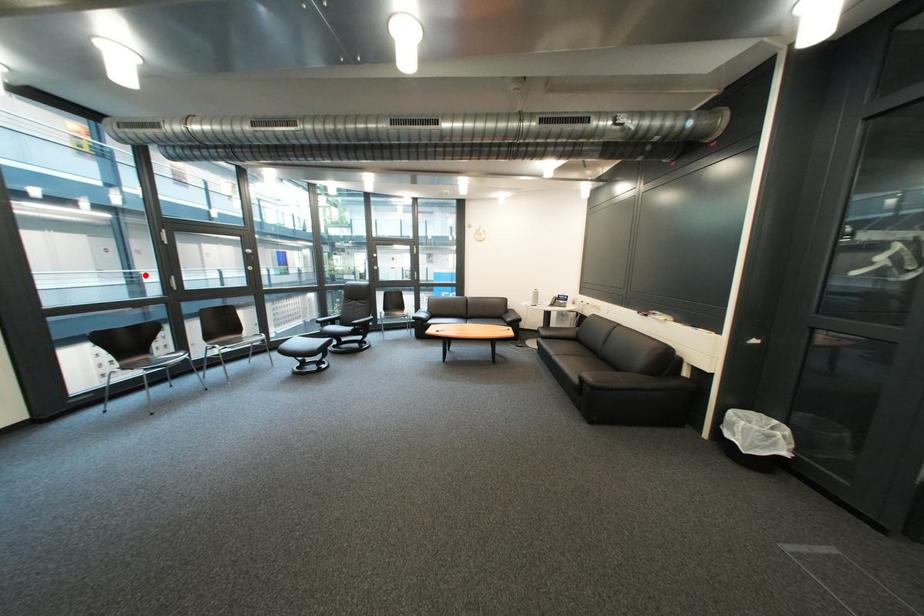
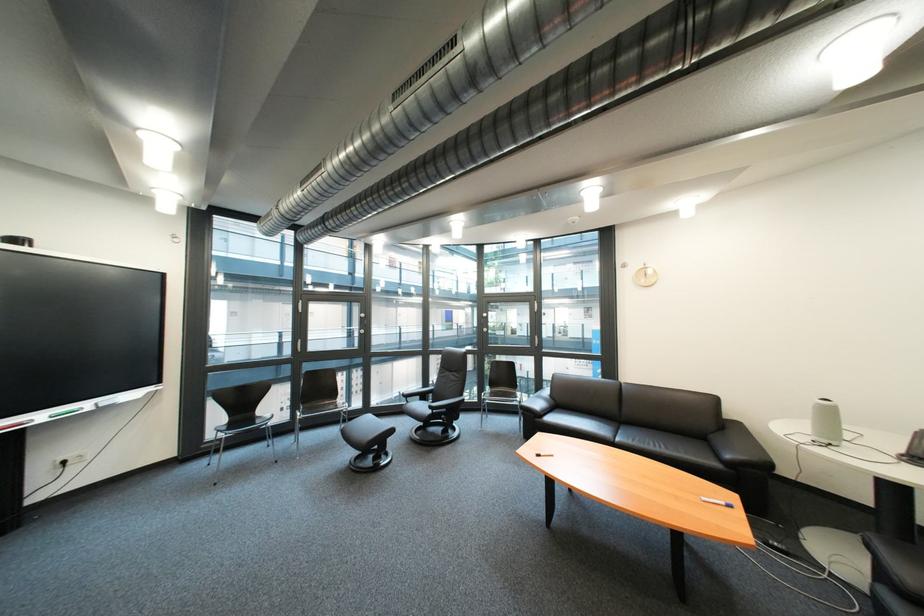
Where in the second image is the point corresponding to the highlighted location from the first image?

(363, 331)